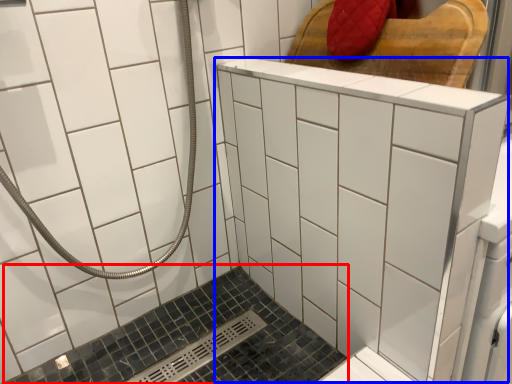
Question: Among these objects, which one is nearest to the camera, bath (highlighted by a red box) or ceramic tile (highlighted by a blue box)?

Choices:
 (A) bath
 (B) ceramic tile

Answer: (B)